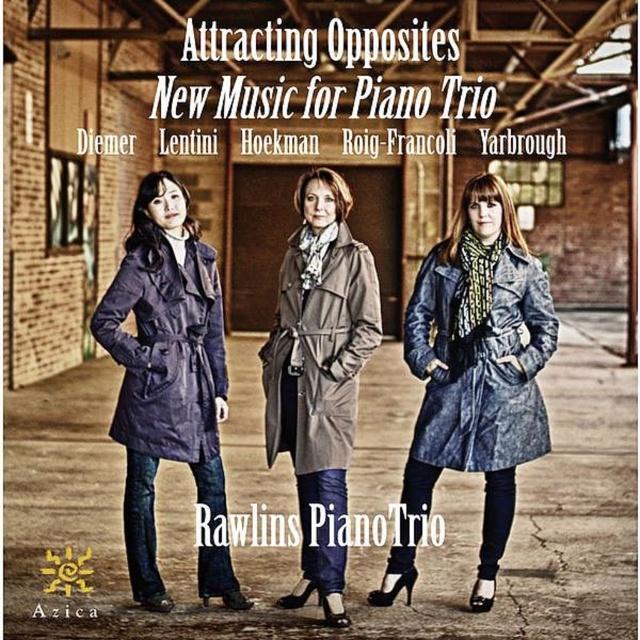
You are a photographer positioned at the front of the image. You need to adjust the focus so that both the denim jacket at lower right and the light gray textured coat at center are in clear view. Which object should you focus on first to ensure both are in focus?

You should focus on the light gray textured coat at center first because it is farther away from the viewer than the denim jacket at lower right. By focusing on the farther object, the near object will also be in focus due to the depth of field.

You are a photographer standing at the center of the room. You need to place a small tripod to capture the denim jacket at lower right. Where should you position the tripod to ensure it is directly in front of the jacket?

The denim jacket at lower right is located at point (481, 364), so place the tripod at the same coordinates to ensure it is directly in front.